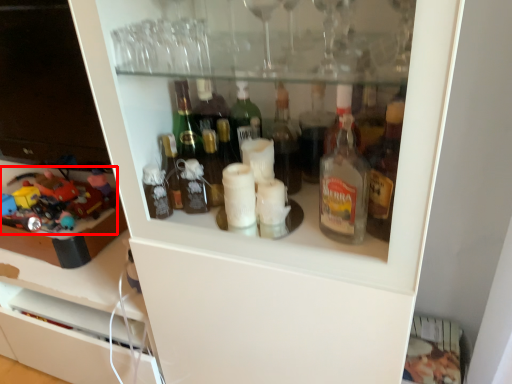
Question: From the image's perspective, what is the correct spatial relationship of toy (annotated by the red box) in relation to toy?

Choices:
 (A) below
 (B) above

Answer: (A)